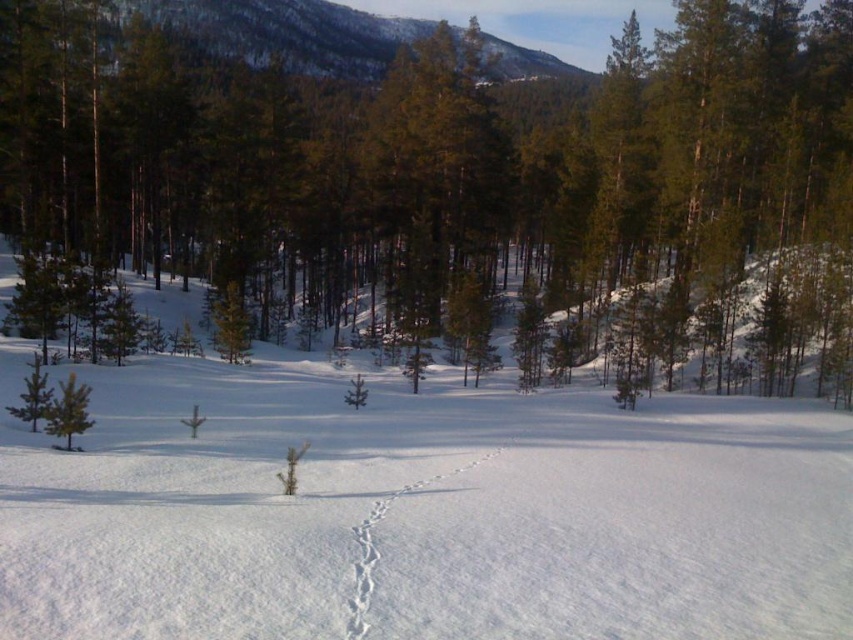
Describe the element at coordinates (418, 509) in the screenshot. The width and height of the screenshot is (853, 640). I see `white fluffy snow at center` at that location.

Identify the location of white fluffy snow at center. (418, 509).

The height and width of the screenshot is (640, 853). I want to click on white fluffy snow at center, so click(418, 509).

From the picture: Between white powdery snow trail at center and green matte tree at lower left, which one is positioned higher?

green matte tree at lower left is higher up.

Can you confirm if white powdery snow trail at center is wider than green matte tree at lower left?

Incorrect, white powdery snow trail at center's width does not surpass green matte tree at lower left's.

Who is more forward, (399, 490) or (51, 406)?

Point (399, 490) is in front.

In order to click on white powdery snow trail at center in this screenshot , I will do `click(376, 548)`.

Who is more distant from viewer, (223, 144) or (819, 481)?

The point (223, 144) is behind.

What do you see at coordinates (451, 180) in the screenshot? The image size is (853, 640). I see `green matte tree at center` at bounding box center [451, 180].

The width and height of the screenshot is (853, 640). What do you see at coordinates (451, 180) in the screenshot? I see `green matte tree at center` at bounding box center [451, 180].

Identify the location of green matte tree at center. This screenshot has width=853, height=640. (451, 180).